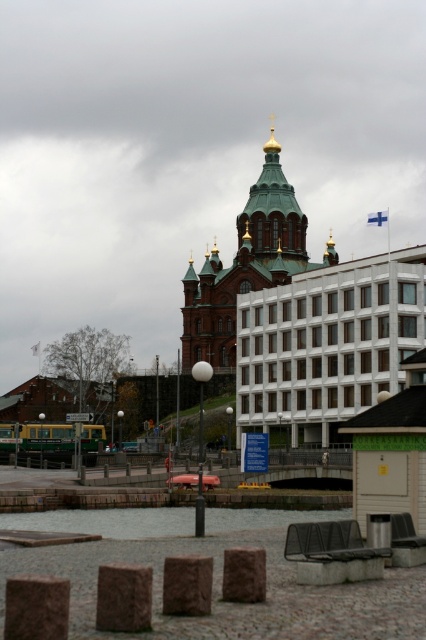
Question: Which point is farther to the camera?

Choices:
 (A) clear water at lower center
 (B) green metallic dome at center

Answer: (B)

Question: Which of the following is the farthest from the observer?

Choices:
 (A) clear water at lower center
 (B) green metallic dome at center

Answer: (B)

Question: Does green metallic dome at center appear on the right side of clear water at lower center?

Choices:
 (A) no
 (B) yes

Answer: (B)

Question: Does green metallic dome at center appear on the right side of clear water at lower center?

Choices:
 (A) no
 (B) yes

Answer: (B)

Question: Is green metallic dome at center positioned behind clear water at lower center?

Choices:
 (A) yes
 (B) no

Answer: (A)